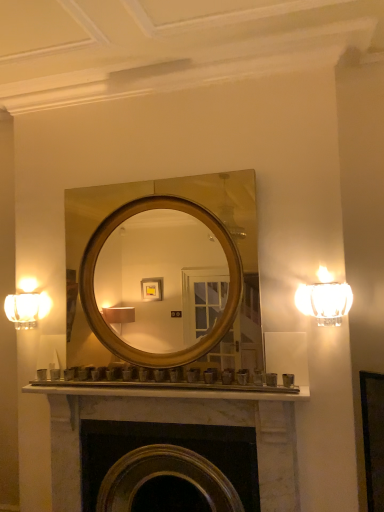
What is the approximate width of clear glass sconce at right?

It is 5.35 inches.

The width and height of the screenshot is (384, 512). Describe the element at coordinates (324, 298) in the screenshot. I see `clear glass sconce at right` at that location.

You are a GUI agent. You are given a task and a screenshot of the screen. Output one action in this format:
    pyautogui.click(x=<x>, y=<y>)
    Task: Click on the gold/metallic mirror at center
    The image size is (384, 512).
    Given the screenshot: What is the action you would take?
    pyautogui.click(x=167, y=194)

Where is `clear glass sconce at right`? clear glass sconce at right is located at coordinates (324, 298).

Are clear glass sconce at right and marble fireplace at center far apart?

clear glass sconce at right is actually quite close to marble fireplace at center.

Would you say clear glass sconce at right is inside or outside marble fireplace at center?

clear glass sconce at right lies outside marble fireplace at center.

Can we say marble fireplace at center lies outside clear glass sconce at right?

marble fireplace at center lies outside clear glass sconce at right's area.

From a real-world perspective, is marble fireplace at center positioned above or below clear glass sconce at right?

Clearly, from a real-world perspective, marble fireplace at center is below clear glass sconce at right.

Which point is more forward, (119, 407) or (336, 312)?

The point (336, 312) is more forward.

Based on the photo, is matte glass sconce at left wider than marble fireplace at center?

No, matte glass sconce at left is not wider than marble fireplace at center.

Which of these two, matte glass sconce at left or marble fireplace at center, is bigger?

Bigger between the two is marble fireplace at center.

Looking at their sizes, would you say gold/metallic mirror at center is wider or thinner than clear glass sconce at right?

Considering their sizes, gold/metallic mirror at center looks broader than clear glass sconce at right.

Does gold/metallic mirror at center contain clear glass sconce at right?

Actually, clear glass sconce at right is outside gold/metallic mirror at center.

Is gold/metallic mirror at center at the right side of clear glass sconce at right?

No, gold/metallic mirror at center is not to the right of clear glass sconce at right.

Looking at this image, which of these two, clear glass sconce at right or gold/metallic mirror at center, is thinner?

clear glass sconce at right.

From the image's perspective, does clear glass sconce at right appear lower than gold/metallic mirror at center?

Yes.

From a real-world perspective, does clear glass sconce at right sit lower than gold/metallic mirror at center?

Yes, from a real-world perspective, clear glass sconce at right is beneath gold/metallic mirror at center.

Locate an element on the screen. Image resolution: width=384 pixels, height=512 pixels. mirror that appears above the clear glass sconce at right (from a real-world perspective) is located at coordinates (167, 194).

Considering their positions, is matte glass sconce at left located in front of or behind clear glass sconce at right?

matte glass sconce at left is behind clear glass sconce at right.

Between matte glass sconce at left and clear glass sconce at right, which one has less height?

Standing shorter between the two is matte glass sconce at left.

Looking at this image, from a real-world perspective, does matte glass sconce at left sit lower than clear glass sconce at right?

Correct, in the physical world, matte glass sconce at left is lower than clear glass sconce at right.

Can you confirm if matte glass sconce at left is wider than clear glass sconce at right?

No, matte glass sconce at left is not wider than clear glass sconce at right.

Between point (74, 264) and point (153, 411), which one is positioned in front?

Point (153, 411)

Consider the image. From a real-world perspective, does gold/metallic mirror at center sit lower than marble fireplace at center?

No, from a real-world perspective, gold/metallic mirror at center is not under marble fireplace at center.

The image size is (384, 512). I want to click on lamp that appears above the marble fireplace at center (from a real-world perspective), so [x=324, y=298].

Identify the location of fireplace beneath the clear glass sconce at right (from a real-world perspective). The width and height of the screenshot is (384, 512). (177, 423).

Looking at the image, which one is located further to gold/metallic mirror at center, marble fireplace at center or clear glass sconce at right?

marble fireplace at center.

Which object lies further to the anchor point marble fireplace at center, clear glass sconce at right or gold/metallic mirror at center?

Among the two, clear glass sconce at right is located further to marble fireplace at center.

From the image, which object appears to be nearer to matte glass sconce at left, gold/metallic mirror at center or marble fireplace at center?

Based on the image, gold/metallic mirror at center appears to be nearer to matte glass sconce at left.

Estimate the real-world distances between objects in this image. Which object is closer to gold/metallic mirror at center, matte glass sconce at left or marble fireplace at center?

matte glass sconce at left is closer to gold/metallic mirror at center.

From the image, which object appears to be nearer to gold/metallic mirror at center, matte glass sconce at left or clear glass sconce at right?

matte glass sconce at left is closer to gold/metallic mirror at center.

From the image, which object appears to be farther from clear glass sconce at right, gold/metallic mirror at center or marble fireplace at center?

marble fireplace at center is positioned further to the anchor clear glass sconce at right.

Based on their spatial positions, is matte glass sconce at left or gold/metallic mirror at center further from clear glass sconce at right?

matte glass sconce at left lies further to clear glass sconce at right than the other object.

Which object lies nearer to the anchor point clear glass sconce at right, marble fireplace at center or matte glass sconce at left?

marble fireplace at center is closer to clear glass sconce at right.

The width and height of the screenshot is (384, 512). Identify the location of lamp that lies between gold/metallic mirror at center and marble fireplace at center from top to bottom. (324, 298).

Find the location of a particular element. The height and width of the screenshot is (512, 384). fireplace situated between matte glass sconce at left and clear glass sconce at right from left to right is located at coordinates (177, 423).

In order to click on fixture that lies between gold/metallic mirror at center and marble fireplace at center from top to bottom in this screenshot , I will do `click(27, 305)`.

Locate an element on the screen. mirror between matte glass sconce at left and clear glass sconce at right in the horizontal direction is located at coordinates (167, 194).